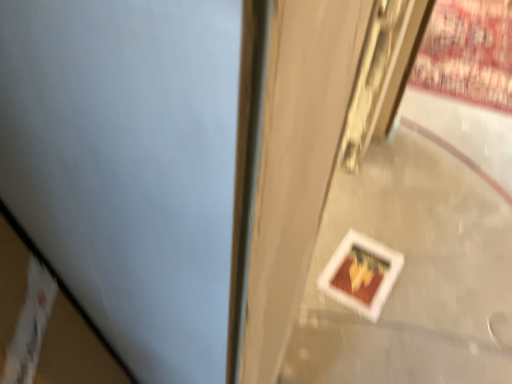
Locate an element on the screen. free point above matte white postcard at lower right (from a real-world perspective) is located at coordinates (362, 269).